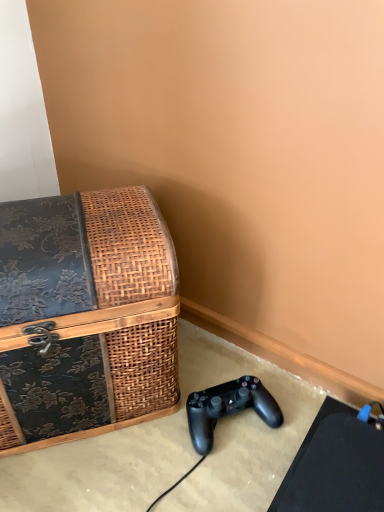
Image resolution: width=384 pixels, height=512 pixels. I want to click on vacant space to the right of black matte game controller at lower right, so coord(292,414).